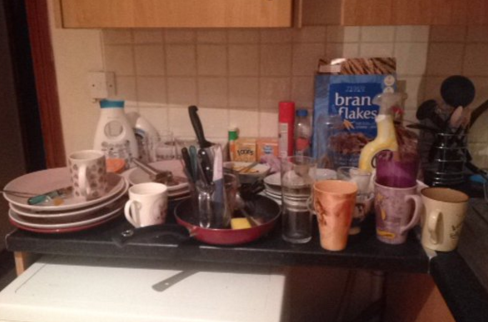
The width and height of the screenshot is (488, 322). In order to click on doorway in this screenshot , I will do `click(17, 145)`.